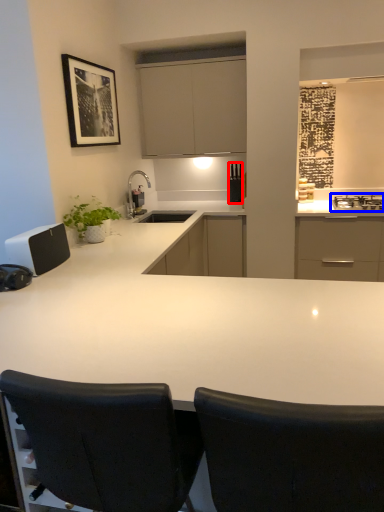
Question: Which object is further to the camera taking this photo, appliance (highlighted by a red box) or gas stove (highlighted by a blue box)?

Choices:
 (A) appliance
 (B) gas stove

Answer: (A)